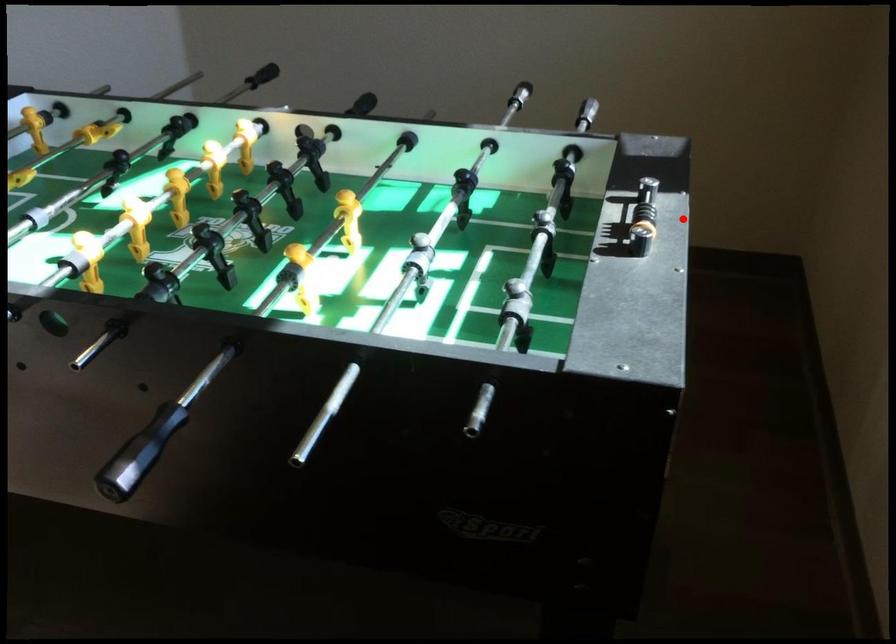
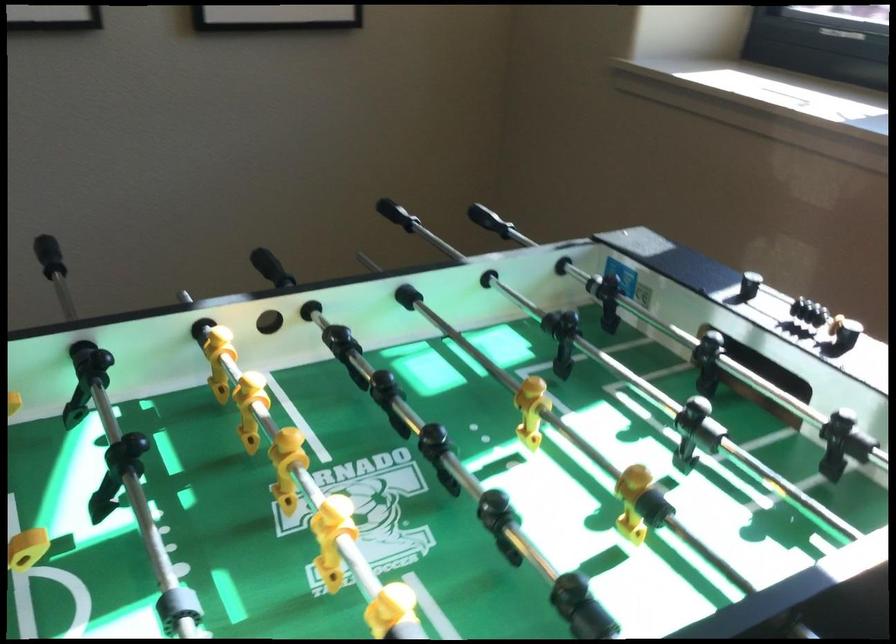
In the second image, find the point that corresponds to the highlighted location in the first image.

(798, 307)